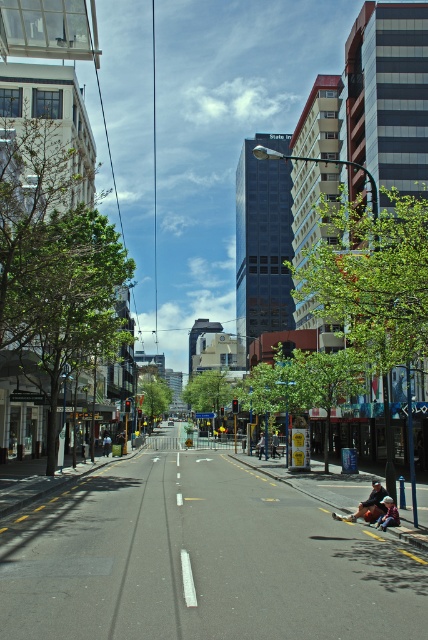
Question: Considering the real-world distances, which object is closest to the denim jacket at lower right?

Choices:
 (A) dark blue jeans at center
 (B) blue denim jeans at center
 (C) leather jacket at lower right
 (D) denim jacket at center

Answer: (C)

Question: Is denim jacket at lower right to the right of denim jacket at center from the viewer's perspective?

Choices:
 (A) no
 (B) yes

Answer: (A)

Question: Which object is the closest to the leather jacket at lower right?

Choices:
 (A) denim jacket at center
 (B) blue denim jeans at center
 (C) denim jacket at lower right

Answer: (C)

Question: Is denim jacket at lower right below dark blue jeans at center?

Choices:
 (A) no
 (B) yes

Answer: (A)

Question: Estimate the real-world distances between objects in this image. Which object is closer to the denim jacket at center?

Choices:
 (A) blue denim jeans at center
 (B) dark blue jeans at center

Answer: (A)

Question: Where is leather jacket at lower right located in relation to denim jacket at center in the image?

Choices:
 (A) above
 (B) below

Answer: (A)